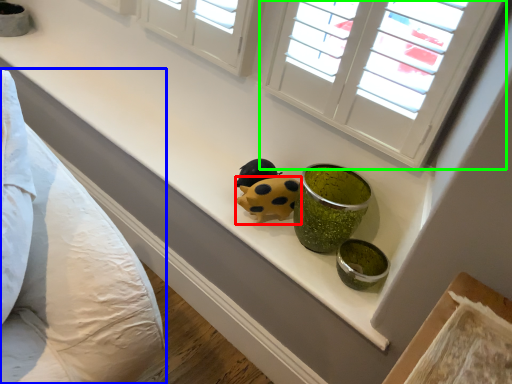
Question: Estimate the real-world distances between objects in this image. Which object is farther from ladybug (highlighted by a red box), bedding (highlighted by a blue box) or window (highlighted by a green box)?

Choices:
 (A) bedding
 (B) window

Answer: (A)